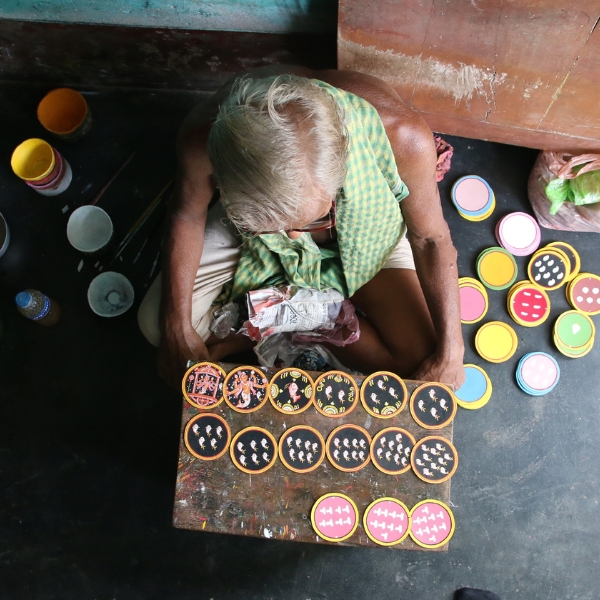
The width and height of the screenshot is (600, 600). In order to click on grey concrete floor in this screenshot , I will do `click(527, 485)`, `click(577, 399)`, `click(369, 577)`, `click(550, 560)`.